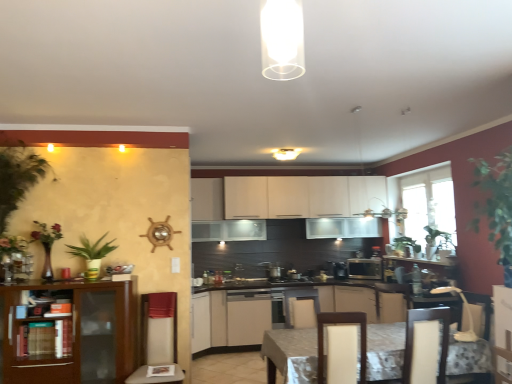
Question: In terms of size, does white matte cabinet at center, the 4th cabinetry in the front-to-back sequence, appear bigger or smaller than green leafy plant at left?

Choices:
 (A) small
 (B) big

Answer: (B)

Question: Is white matte cabinet at center, the 4th cabinetry in the front-to-back sequence, taller or shorter than green leafy plant at left?

Choices:
 (A) short
 (B) tall

Answer: (B)

Question: Estimate the real-world distances between objects in this image. Which object is closer to the matte white cabinets at center, the 2th cabinetry viewed from the front?

Choices:
 (A) satin silver microwave at center
 (B) light brown wood swivel chair at center, arranged as the 2th swivel chair when viewed from the right
 (C) marble-patterned table at center
 (D) green leafy plant at left
 (E) white glossy cabinets at center, which is the fifth cabinetry in front-to-back order

Answer: (A)

Question: Which is nearer to the green leafy plant at left?

Choices:
 (A) satin silver toaster at center
 (B) black plastic coffee machine at center
 (C) beige fabric swivel chair at left, which ranks as the first swivel chair in left-to-right order
 (D) white glossy cabinet at center, acting as the fifth cabinetry starting from the back
 (E) white plastic swivel chair at lower right, marked as the 1th swivel chair in a right-to-left arrangement

Answer: (C)